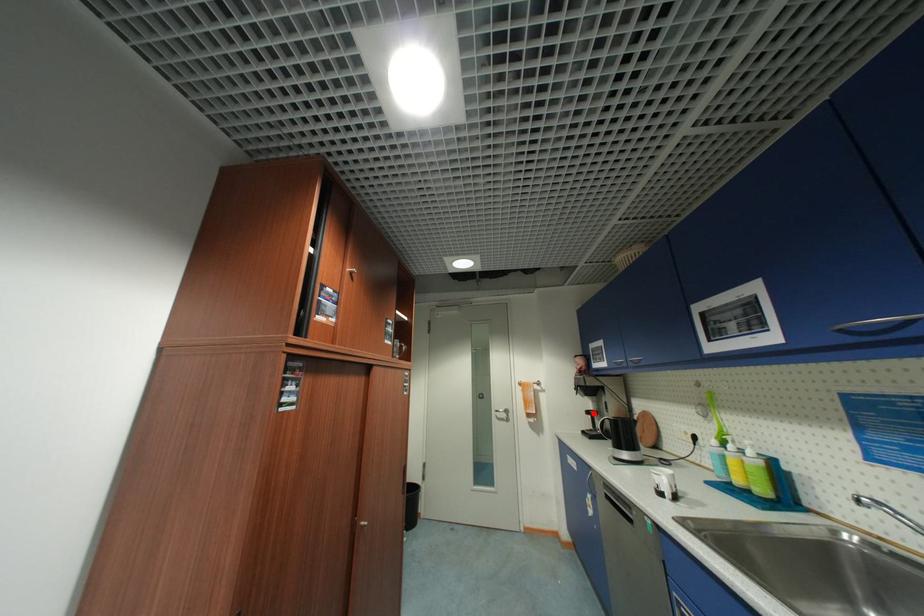
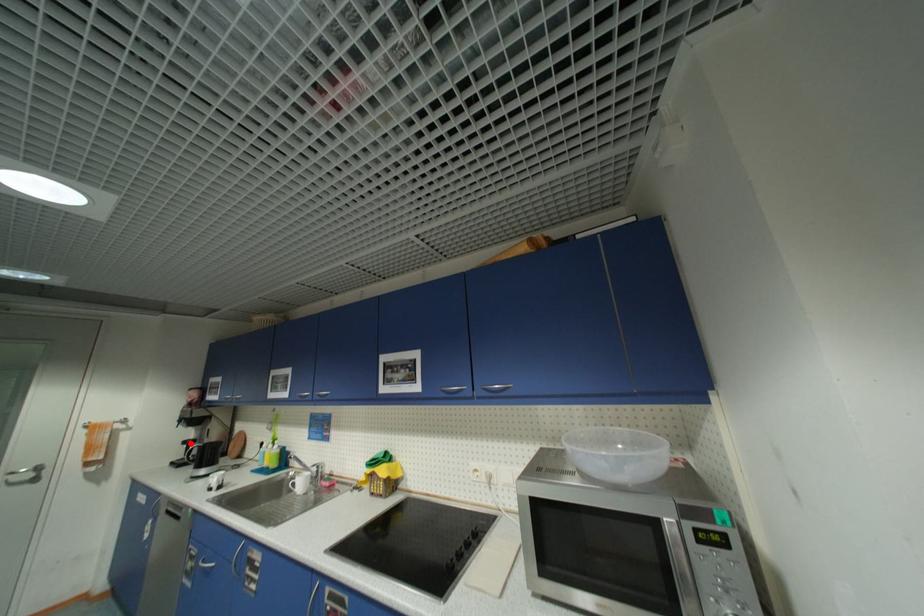
I am providing you with two images of the same scene from different viewpoints. A red point is marked on the first image and another point is marked on the second image. Is the marked point in image1 the same physical position as the marked point in image2?

Yes